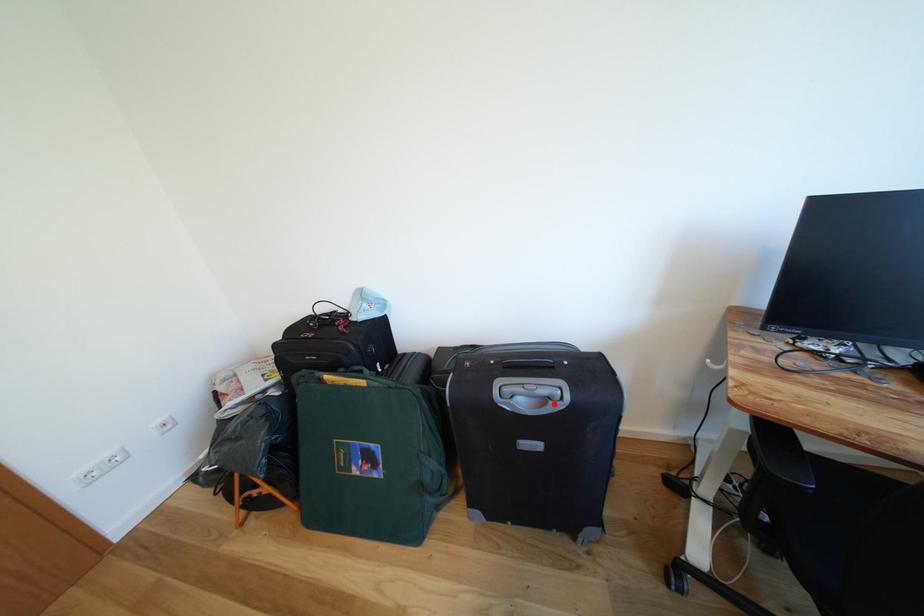
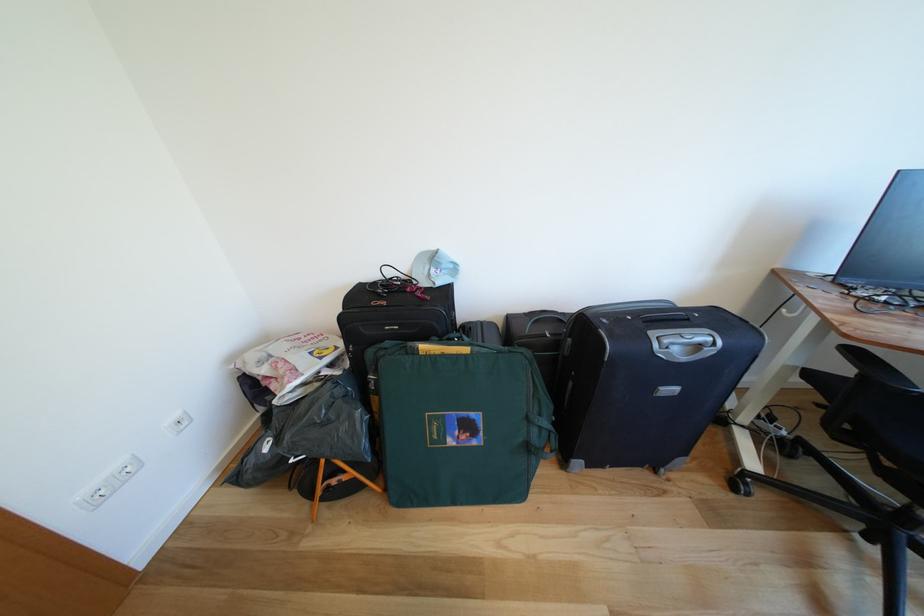
The point at the highlighted location is marked in the first image. Where is the corresponding point in the second image?

(707, 351)